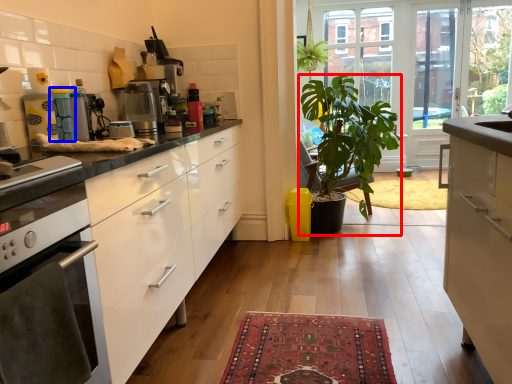
Question: Which point is closer to the camera, houseplant (highlighted by a red box) or appliance (highlighted by a blue box)?

Choices:
 (A) houseplant
 (B) appliance

Answer: (B)